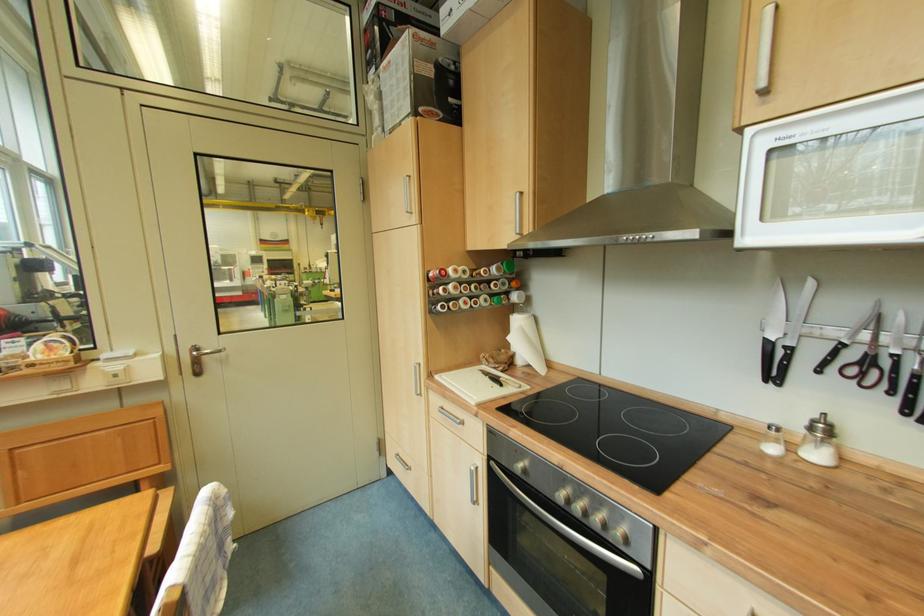
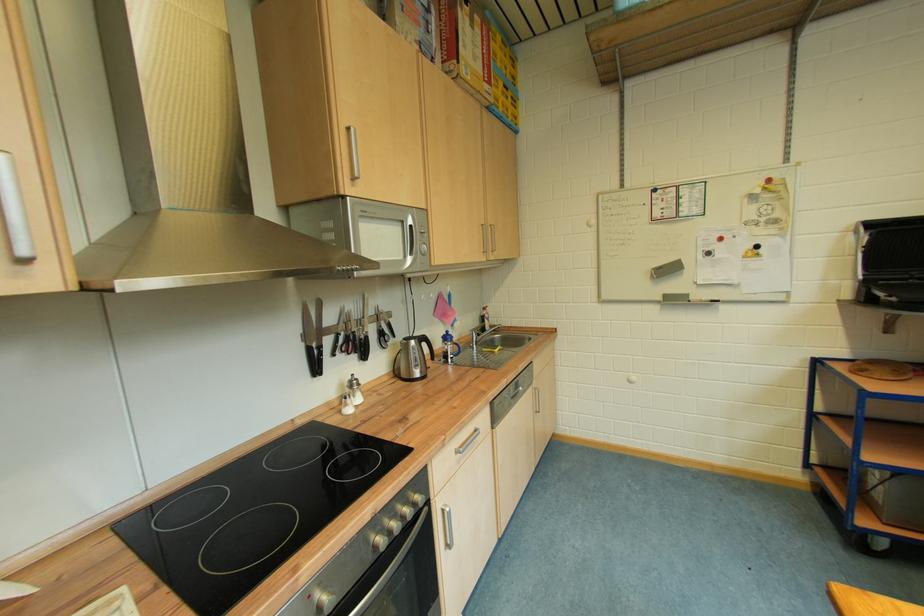
The point at (850, 349) is marked in the first image. Where is the corresponding point in the second image?

(345, 338)